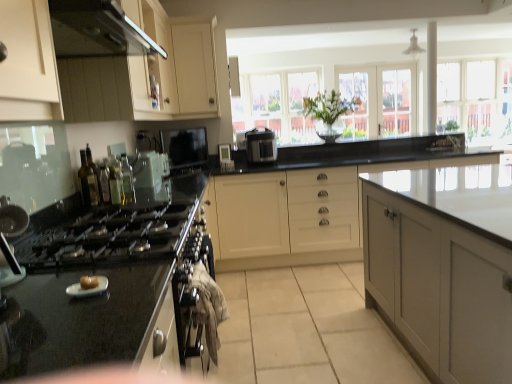
Question: Is white glossy digital clock at center, acting as the first appliance starting from the back, taller than satin black rice cooker at center?

Choices:
 (A) yes
 (B) no

Answer: (B)

Question: Can you confirm if white glossy digital clock at center, marked as the 3th appliance in a left-to-right arrangement, is thinner than satin black rice cooker at center?

Choices:
 (A) yes
 (B) no

Answer: (A)

Question: From a real-world perspective, is white glossy digital clock at center, the 3th appliance positioned from the bottom, located higher than satin black rice cooker at center?

Choices:
 (A) yes
 (B) no

Answer: (B)

Question: Would you say satin black rice cooker at center is part of white glossy digital clock at center, acting as the first appliance starting from the back,'s contents?

Choices:
 (A) no
 (B) yes

Answer: (A)

Question: Is white glossy digital clock at center, the first appliance when ordered from top to bottom, looking in the opposite direction of satin black rice cooker at center?

Choices:
 (A) no
 (B) yes

Answer: (A)

Question: Does point (123, 182) appear closer or farther from the camera than point (90, 165)?

Choices:
 (A) farther
 (B) closer

Answer: (B)

Question: Visually, is green glass bottle at left, which ranks as the 3th bottle in back-to-front order, positioned to the left or to the right of green glass bottle at left, the fourth bottle when ordered from back to front?

Choices:
 (A) right
 (B) left

Answer: (A)

Question: Looking at the image, does green glass bottle at left, which is the 2th bottle in front-to-back order, seem bigger or smaller compared to green glass bottle at left, placed as the first bottle when sorted from front to back?

Choices:
 (A) small
 (B) big

Answer: (A)

Question: In terms of height, does green glass bottle at left, which is the 2th bottle in front-to-back order, look taller or shorter compared to green glass bottle at left, placed as the first bottle when sorted from front to back?

Choices:
 (A) short
 (B) tall

Answer: (A)

Question: Looking at the image, does black granite countertop at center seem bigger or smaller compared to translucent glass bottles at left, which is the 1th bottle in back-to-front order?

Choices:
 (A) small
 (B) big

Answer: (B)

Question: Is black granite countertop at center wider or thinner than translucent glass bottles at left, which is the 4th bottle from front to back?

Choices:
 (A) wide
 (B) thin

Answer: (A)

Question: From the image's perspective, is black granite countertop at center above or below translucent glass bottles at left, which is the 1th bottle in back-to-front order?

Choices:
 (A) above
 (B) below

Answer: (B)

Question: Is point (312, 178) positioned closer to the camera than point (133, 182)?

Choices:
 (A) farther
 (B) closer

Answer: (A)

Question: Is green glass bottle at left, which ranks as the 3th bottle in back-to-front order, bigger or smaller than clear glass window at upper right?

Choices:
 (A) small
 (B) big

Answer: (A)

Question: Based on their positions, is green glass bottle at left, which is the 2th bottle in front-to-back order, located to the left or right of clear glass window at upper right?

Choices:
 (A) right
 (B) left

Answer: (B)